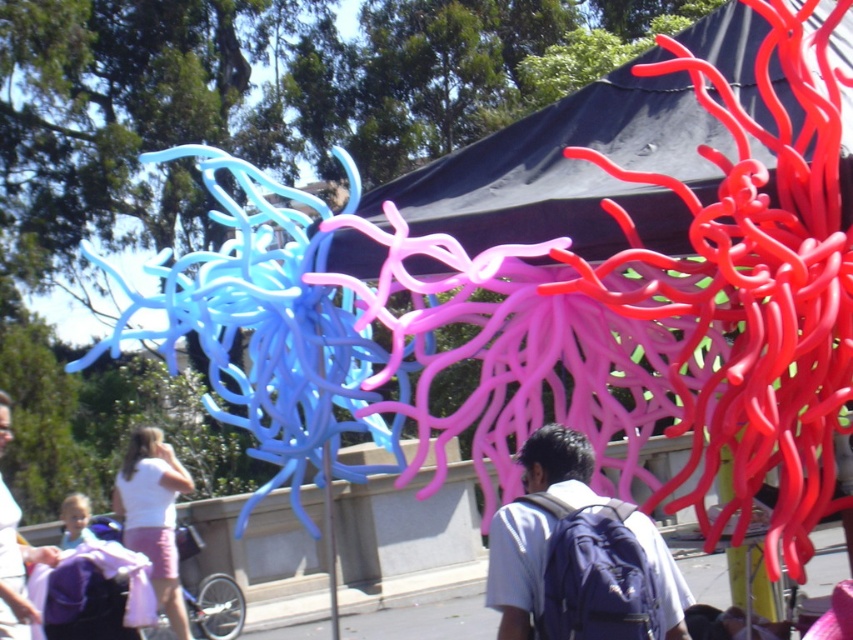
Can you confirm if purple fabric backpack at center is positioned to the right of white cotton shirt at lower left?

Indeed, purple fabric backpack at center is positioned on the right side of white cotton shirt at lower left.

Can you confirm if purple fabric backpack at center is bigger than white cotton shirt at lower left?

Incorrect, purple fabric backpack at center is not larger than white cotton shirt at lower left.

Where is `purple fabric backpack at center`? This screenshot has width=853, height=640. purple fabric backpack at center is located at coordinates (578, 556).

I want to click on purple fabric backpack at center, so click(x=578, y=556).

Between black fabric canopy at upper center and purple fabric backpack at center, which one has more height?

purple fabric backpack at center

Is black fabric canopy at upper center below purple fabric backpack at center?

No.

Which is behind, point (670, 250) or point (595, 584)?

The point (670, 250) is more distant.

Find the location of a particular element. black fabric canopy at upper center is located at coordinates (570, 170).

Is black fabric canopy at upper center thinner than white cotton shirt at lower left?

Indeed, black fabric canopy at upper center has a lesser width compared to white cotton shirt at lower left.

Consider the image. Is black fabric canopy at upper center shorter than white cotton shirt at lower left?

Correct, black fabric canopy at upper center is not as tall as white cotton shirt at lower left.

You are a GUI agent. You are given a task and a screenshot of the screen. Output one action in this format:
    pyautogui.click(x=<x>, y=<y>)
    Task: Click on the black fabric canopy at upper center
    This screenshot has width=853, height=640.
    Given the screenshot: What is the action you would take?
    pyautogui.click(x=570, y=170)

Where is `black fabric canopy at upper center`? The image size is (853, 640). black fabric canopy at upper center is located at coordinates (570, 170).